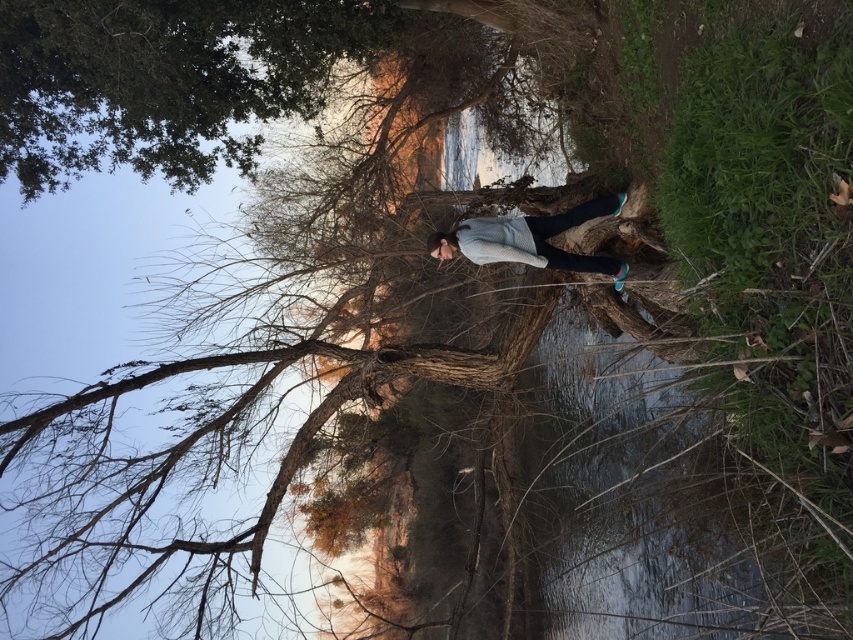
Question: Can you confirm if green leafy tree at upper left is wider than white sweater at center?

Choices:
 (A) yes
 (B) no

Answer: (A)

Question: Does green leafy tree at upper left lie in front of white sweater at center?

Choices:
 (A) yes
 (B) no

Answer: (B)

Question: Is green leafy tree at upper left wider than white sweater at center?

Choices:
 (A) yes
 (B) no

Answer: (A)

Question: Among these points, which one is farthest from the camera?

Choices:
 (A) (503, 234)
 (B) (308, 76)

Answer: (B)

Question: Which object is closer to the camera taking this photo?

Choices:
 (A) white sweater at center
 (B) green leafy tree at upper left

Answer: (A)